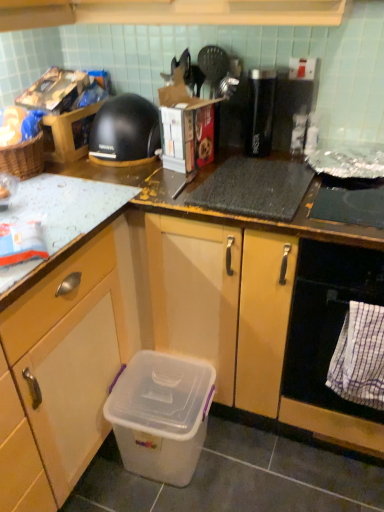
The height and width of the screenshot is (512, 384). Identify the location of free space in front of black matte coffee maker at upper left. (104, 179).